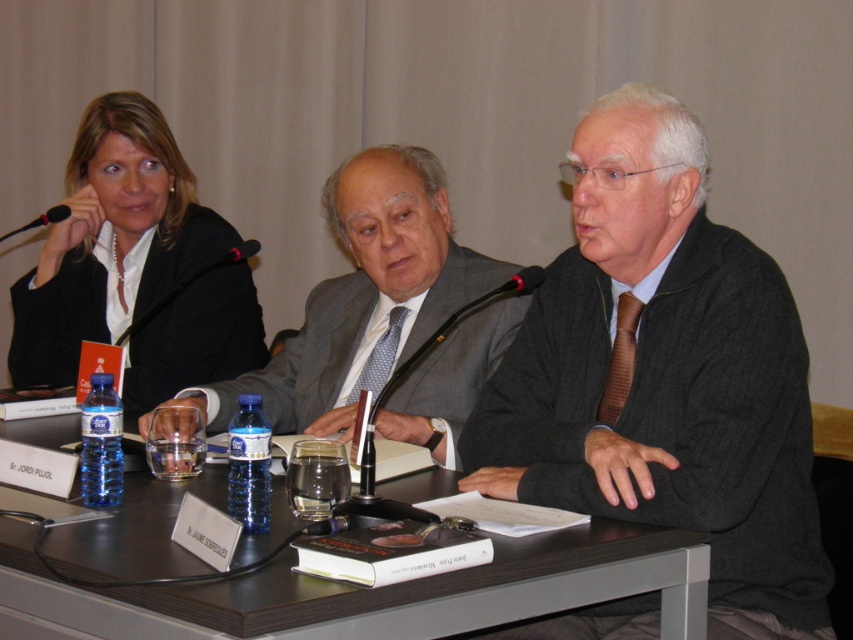
Is point (538, 372) behind point (229, 278)?

That is False.

Measure the distance between point (589, 460) and camera.

A distance of 4.97 feet exists between point (589, 460) and camera.

Find the location of `brown textured sweater at center`. brown textured sweater at center is located at coordinates (663, 376).

Measure the distance between point (177, 237) and camera.

Point (177, 237) and camera are 2.60 meters apart from each other.

What do you see at coordinates (134, 268) in the screenshot? I see `matte black jacket at upper left` at bounding box center [134, 268].

What do you see at coordinates (134, 268) in the screenshot?
I see `matte black jacket at upper left` at bounding box center [134, 268].

This screenshot has height=640, width=853. I want to click on matte black jacket at upper left, so click(134, 268).

Is dark wood table at center below black plastic microphone at upper left?

Yes, dark wood table at center is below black plastic microphone at upper left.

Which of these two, dark wood table at center or black plastic microphone at upper left, stands shorter?

Standing shorter between the two is black plastic microphone at upper left.

Find the location of a particular element. This screenshot has width=853, height=640. dark wood table at center is located at coordinates (381, 592).